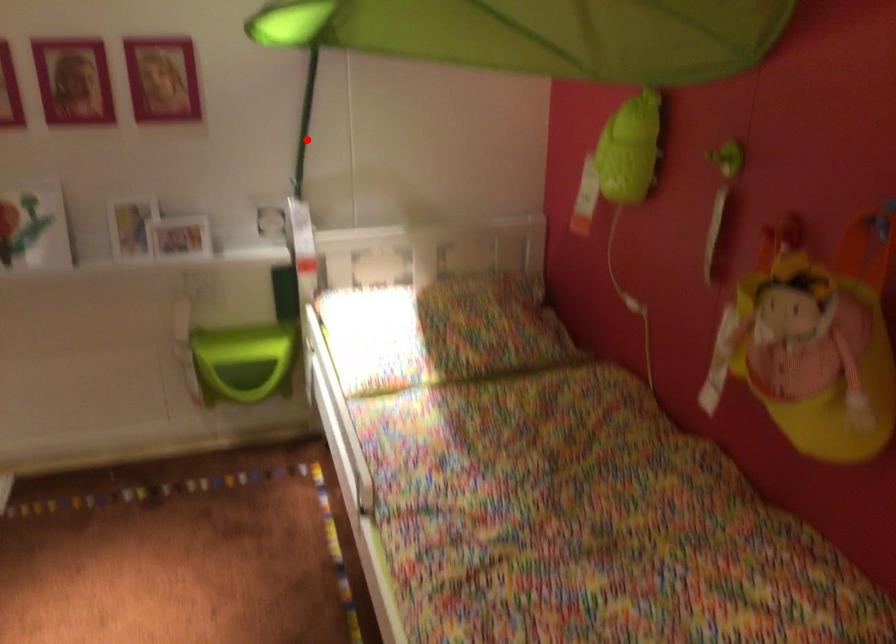
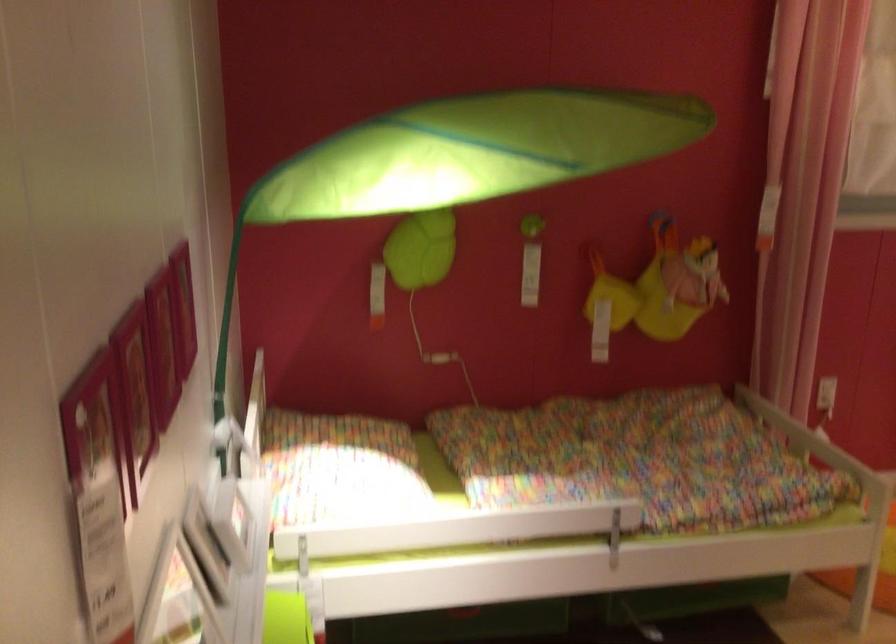
Question: I am providing you with two images of the same scene from different viewpoints. In image1, a red point is highlighted. Considering the same 3D point in image2, which of the following is correct?

Choices:
 (A) It is closer
 (B) It is farther

Answer: (A)